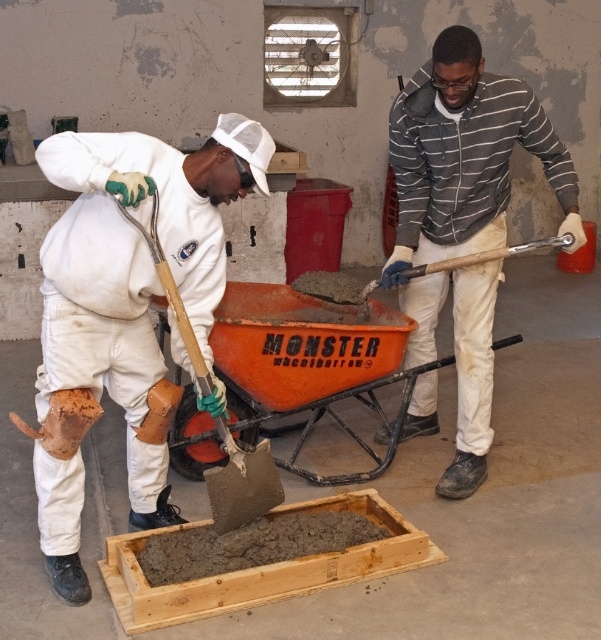
Where is `orange plastic wheelbarrow at center`? Image resolution: width=601 pixels, height=640 pixels. orange plastic wheelbarrow at center is located at coordinates (307, 362).

Based on the photo, is orange plastic wheelbarrow at center positioned in front of smooth concrete shovel at center?

That is True.

Is point (296, 406) closer to viewer compared to point (435, 264)?

No.

Locate an element on the screen. orange plastic wheelbarrow at center is located at coordinates (307, 362).

Between point (471, 326) and point (294, 452), which one is positioned behind?

The point (294, 452) is more distant.

Locate an element on the screen. Image resolution: width=601 pixels, height=640 pixels. striped cotton hoodie at center is located at coordinates (462, 170).

Is point (156, 257) positioned behind point (534, 248)?

That is False.

Can you confirm if wooden shovel at center is bigger than smooth concrete shovel at center?

Yes.

Where is `wooden shovel at center`? This screenshot has width=601, height=640. wooden shovel at center is located at coordinates (242, 483).

Image resolution: width=601 pixels, height=640 pixels. I want to click on wooden shovel at center, so tap(242, 483).